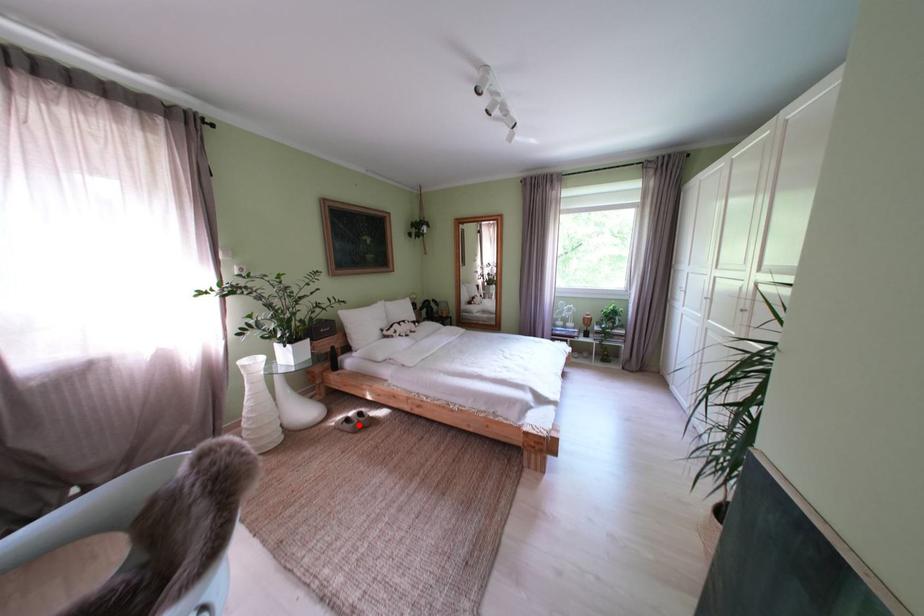
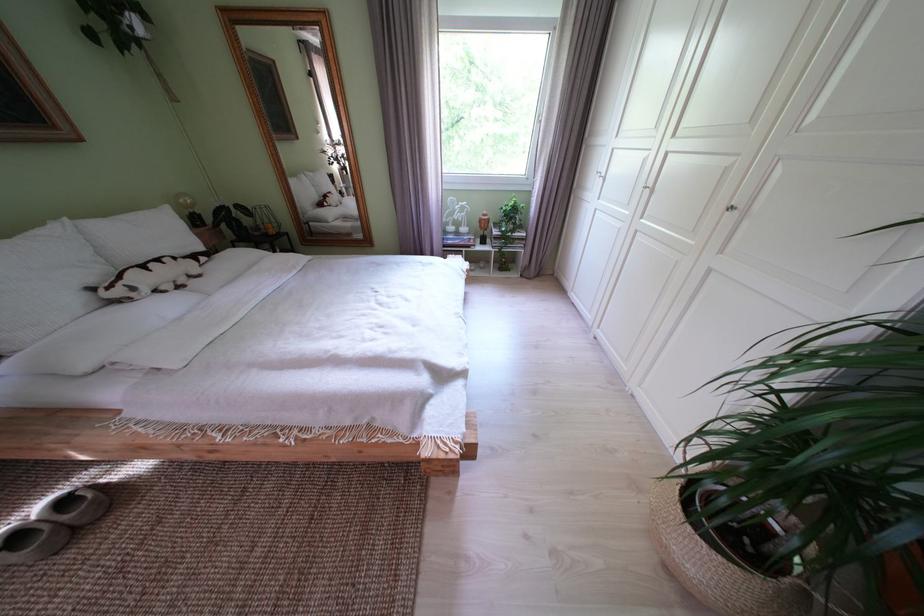
The point at the highlighted location is marked in the first image. Where is the corresponding point in the second image?

(28, 543)